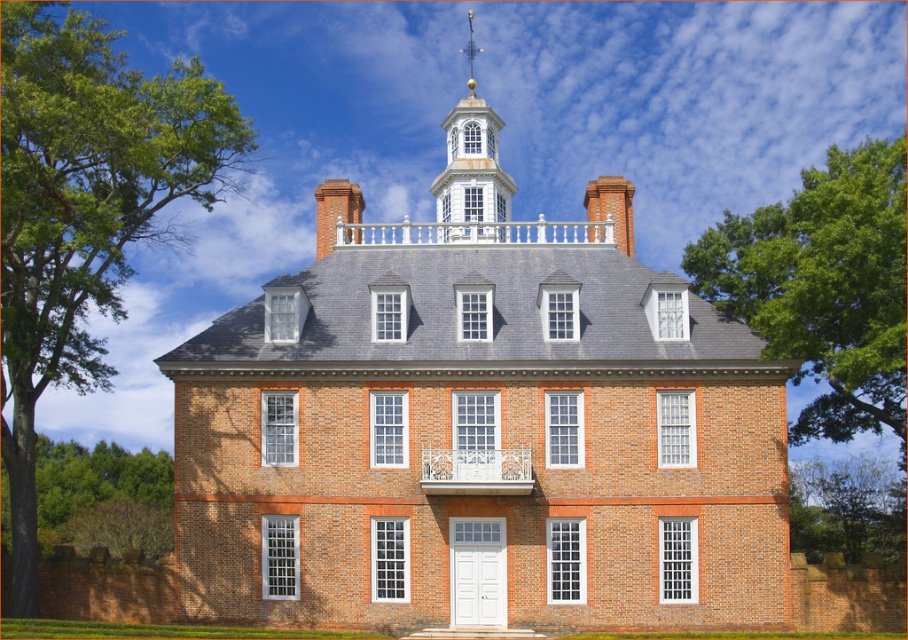
You are a drone operator tasked with capturing aerial footage of the historic brick building. Your drone must fly from the green leafy tree at left to the white painted wood spire at upper center. Given that the drone has a maximum flight range of 20 meters, will it be able to reach the spire without needing to recharge?

The green leafy tree at left is 21.64 meters from the white painted wood spire at upper center. Since the distance exceeds the drone s 20 meter range, the drone will not be able to reach the spire without recharging.

You are standing in front of the historic brick building and want to take a photo that includes both the green leafy tree at left and the white painted wood spire at upper center. Based on their positions, which object should you ensure is visible on the left side of your photo?

The green leafy tree at left should be visible on the left side of the photo because it is positioned on the left side of the white painted wood spire at upper center.